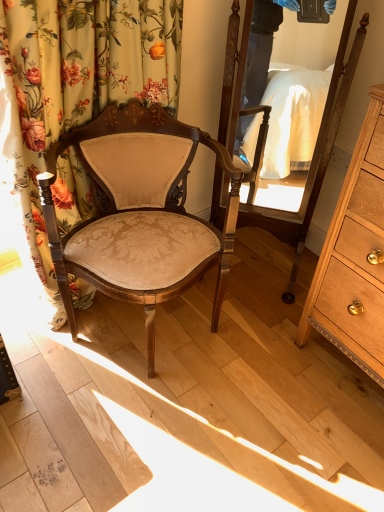
At what (x,y) coordinates should I click in order to perform the action: click on vacant area that lies between wooden mirror at center and matte beige fabric chair at center. Please return your answer as a coordinate pair (x, y). This screenshot has height=512, width=384. Looking at the image, I should click on (255, 316).